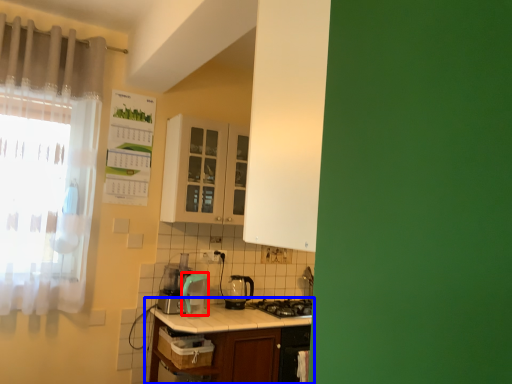
Question: Which point is further to the camera, appliance (highlighted by a red box) or table (highlighted by a blue box)?

Choices:
 (A) appliance
 (B) table

Answer: (A)